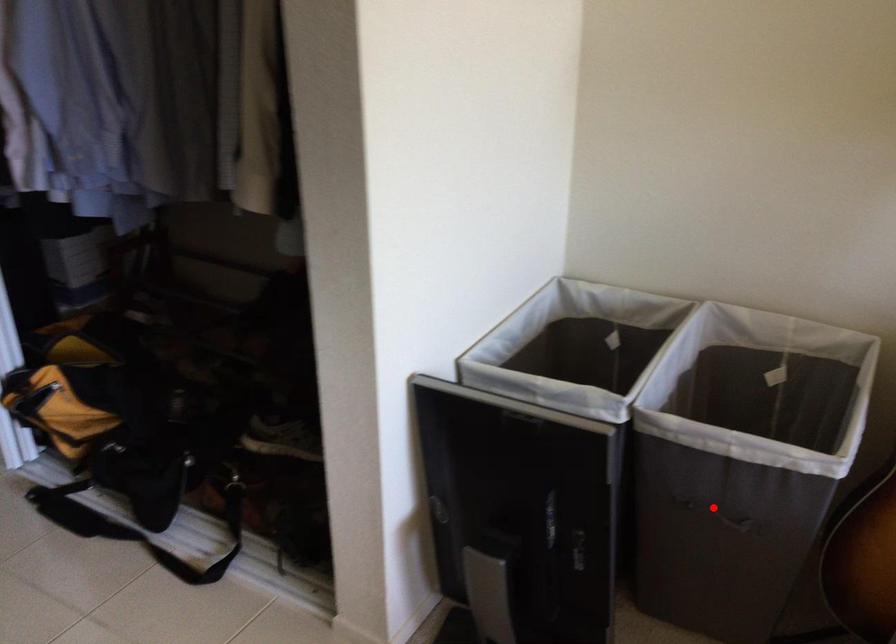
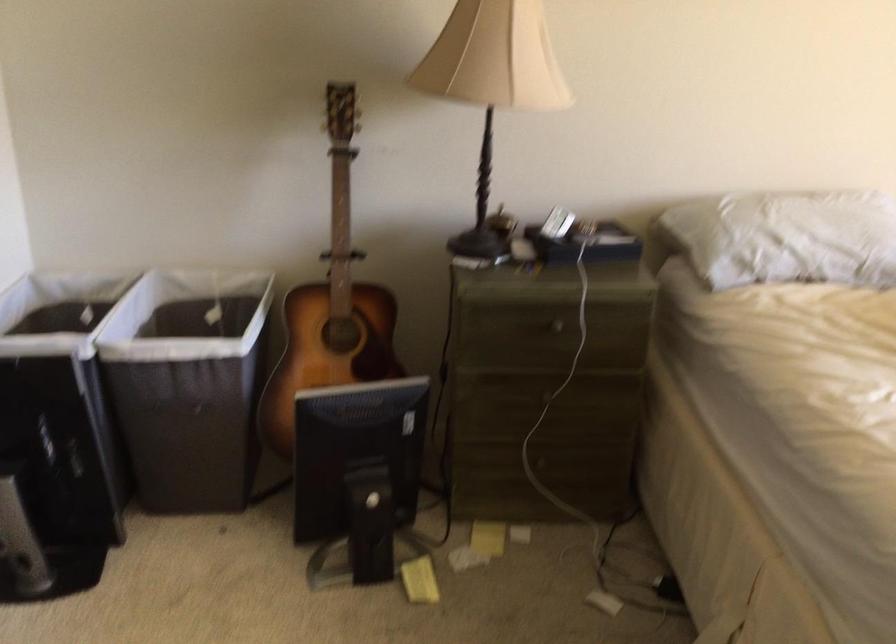
Question: I am providing you with two images of the same scene from different viewpoints. Image1 has a red point marked. In image2, the corresponding 3D location appears at what relative position? Reply with the corresponding letter.

Choices:
 (A) Closer
 (B) Farther

Answer: (B)